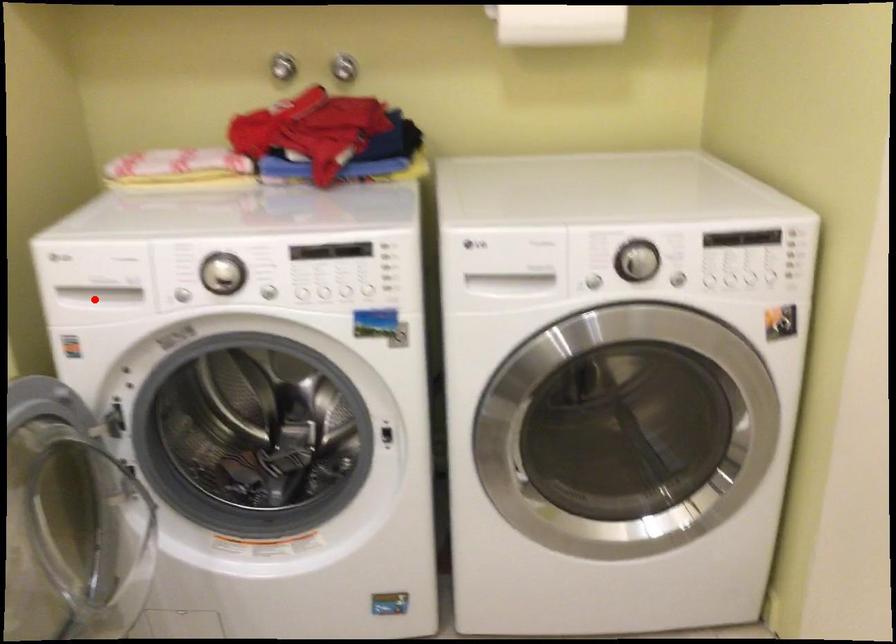
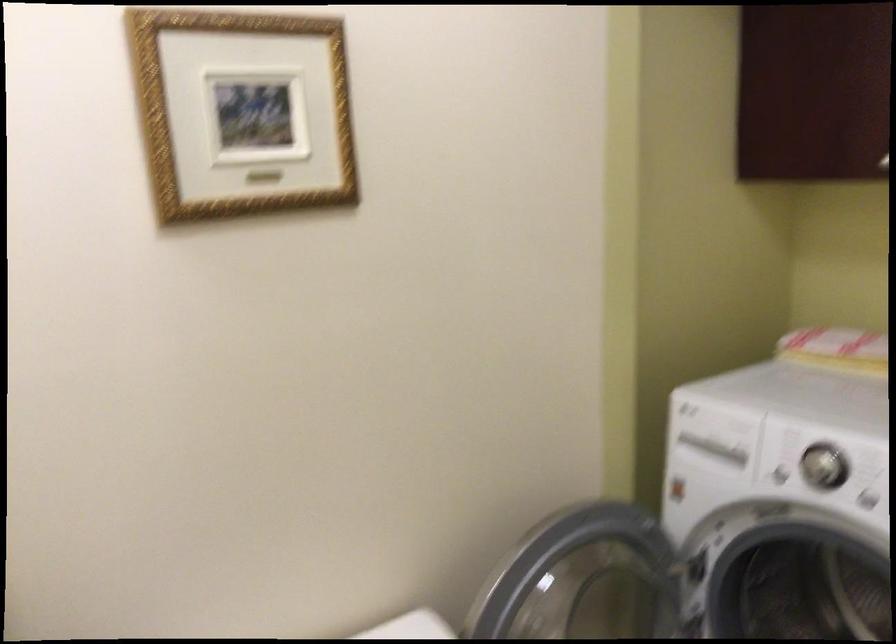
Question: I am providing you with two images of the same scene from different viewpoints. A red point is marked on the first image. At the location where the point appears in image 1, is it still visible in image 2?

Choices:
 (A) Yes
 (B) No

Answer: (A)